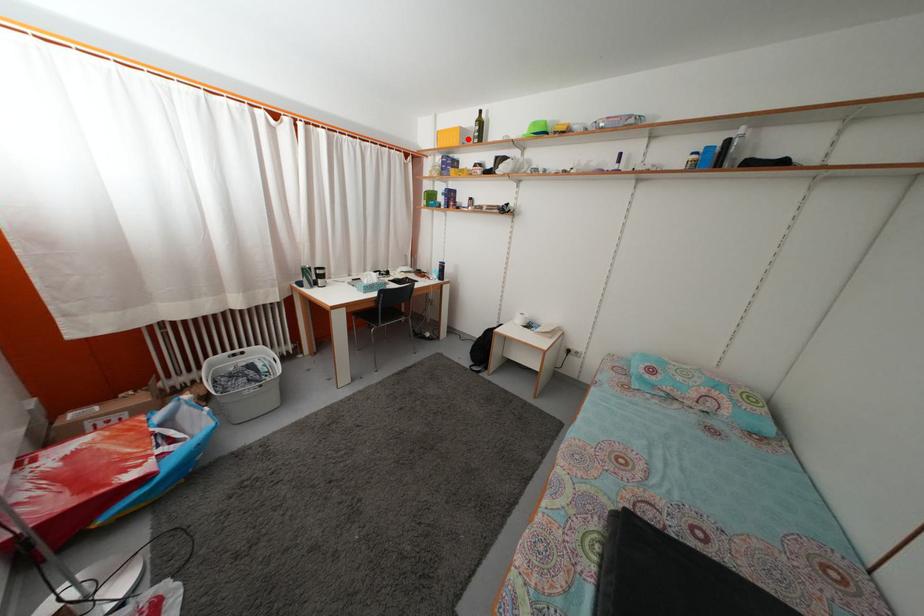
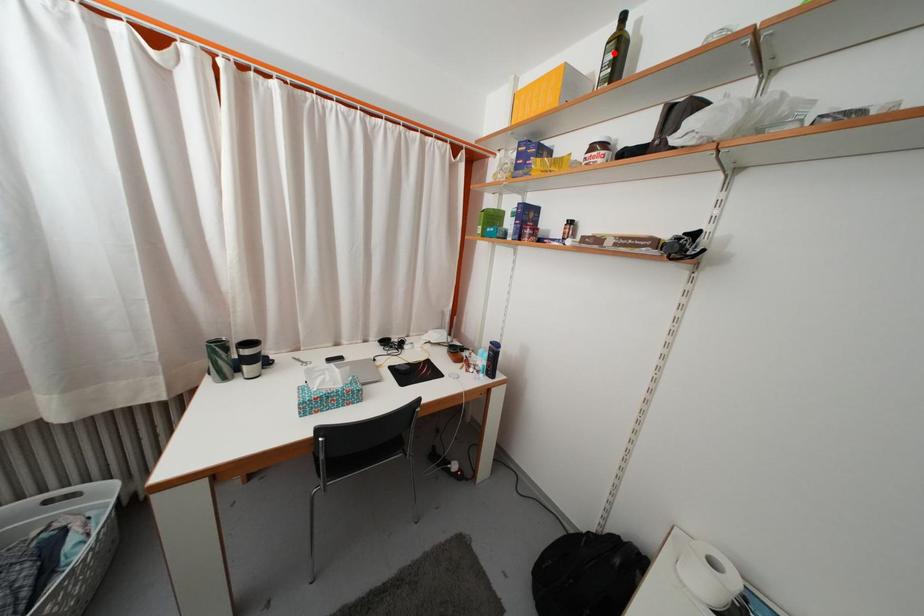
I am providing you with two images of the same scene from different viewpoints. A red point is marked on the first image and another point is marked on the second image. Do the highlighted points in image1 and image2 indicate the same real-world spot?

No